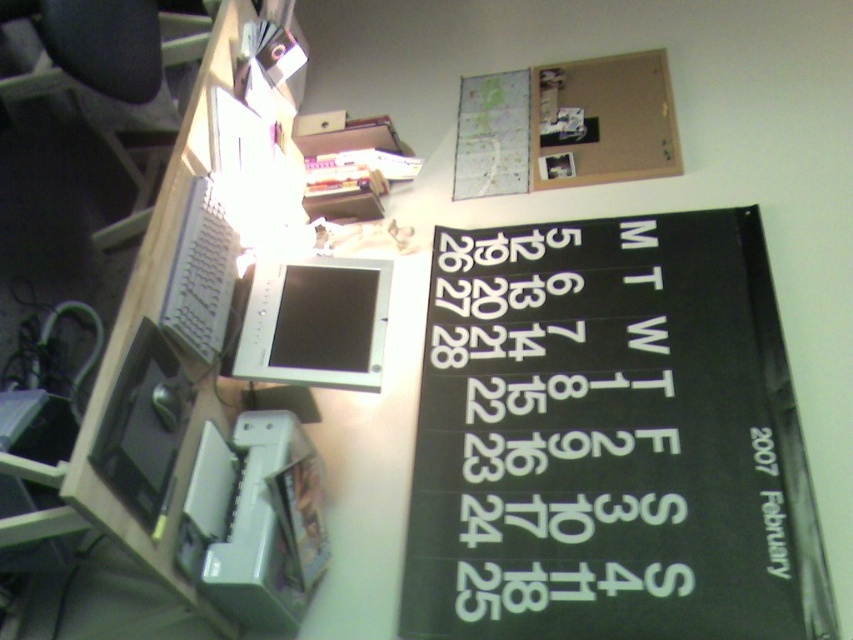
You are sitting in the black office chair at the top left corner of the desk. You need to reach both the white plastic printer at lower center and the satin silver monitor at center. Which object will you need to lean forward less to touch?

The white plastic printer at lower center is closer to the viewer than the satin silver monitor at center, so you will need to lean forward less to touch the white plastic printer at lower center.

What object is located at the point with coordinates (566, 125)?

The point with coordinates (566, 125) marks a corkboard at upper center.

You need to hang a large poster that requires a surface wider than the white plastic printer at lower center. Is the corkboard at upper center suitable for this purpose?

The corkboard at upper center might be wider than the white plastic printer at lower center, so it could be suitable for hanging the large poster.